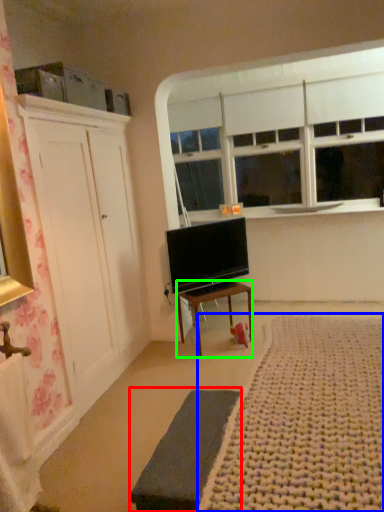
Question: Which object is the closest to the bed frame (highlighted by a red box)? Choose among these: plain (highlighted by a blue box) or desk (highlighted by a green box).

Choices:
 (A) plain
 (B) desk

Answer: (A)